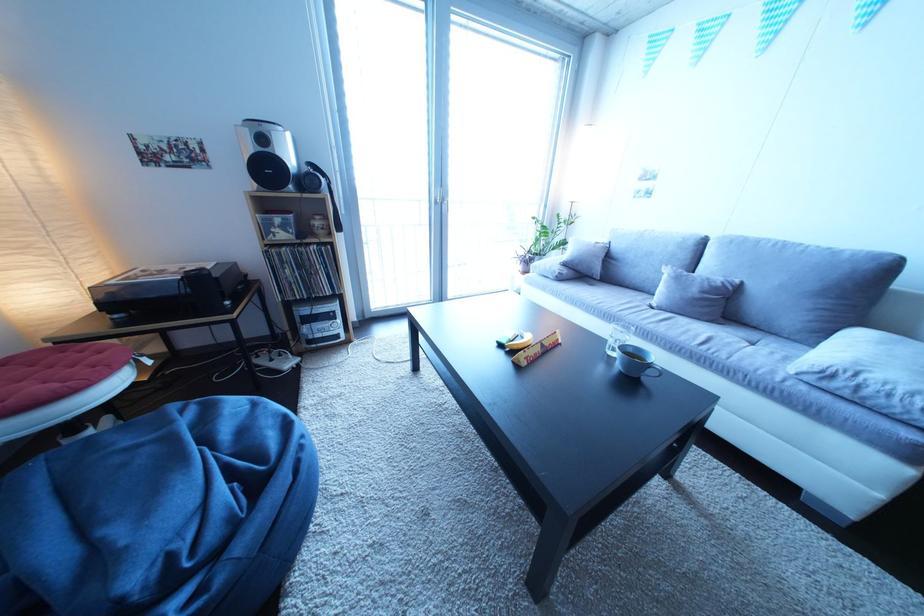
This screenshot has height=616, width=924. I want to click on sofa sitting surface, so click(x=762, y=277).